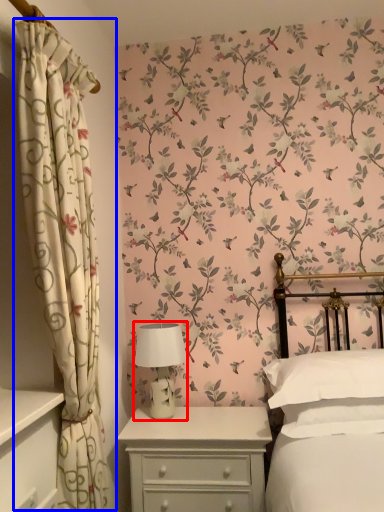
Question: Which point is closer to the camera, table lamp (highlighted by a red box) or curtain (highlighted by a blue box)?

Choices:
 (A) table lamp
 (B) curtain

Answer: (B)